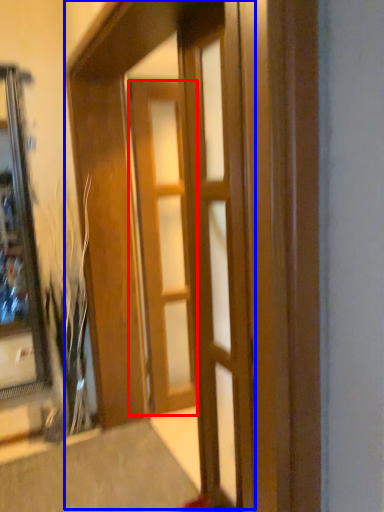
Question: Which object is further to the camera taking this photo, door (highlighted by a red box) or barn door (highlighted by a blue box)?

Choices:
 (A) door
 (B) barn door

Answer: (A)